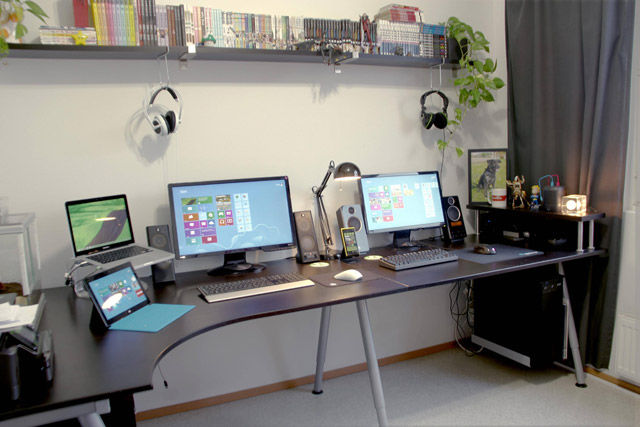
Identify the location of mouse. (349, 275), (486, 252).